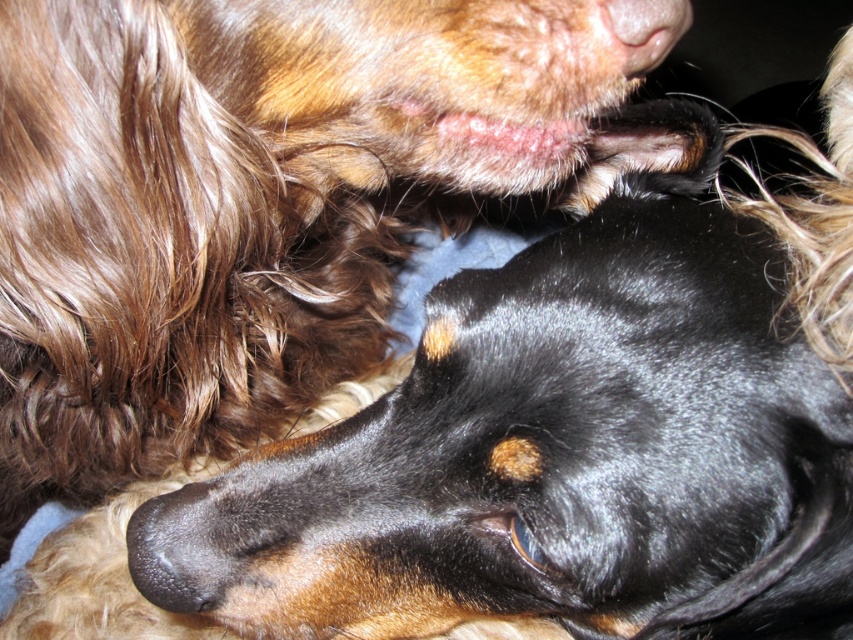
In the scene shown: Is black shiny dog at center wider than pink soft skin at upper center?

Indeed, black shiny dog at center has a greater width compared to pink soft skin at upper center.

Describe the element at coordinates (244, 204) in the screenshot. I see `black shiny dog at center` at that location.

What do you see at coordinates (244, 204) in the screenshot? I see `black shiny dog at center` at bounding box center [244, 204].

Locate an element on the screen. black shiny dog at center is located at coordinates 244,204.